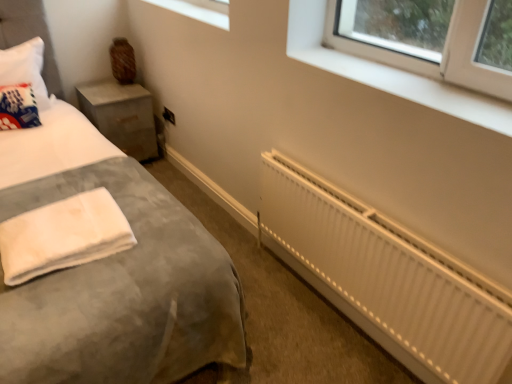
Locate an element on the screen. free spot above white fluffy towel at lower left (from a real-world perspective) is located at coordinates (59, 221).